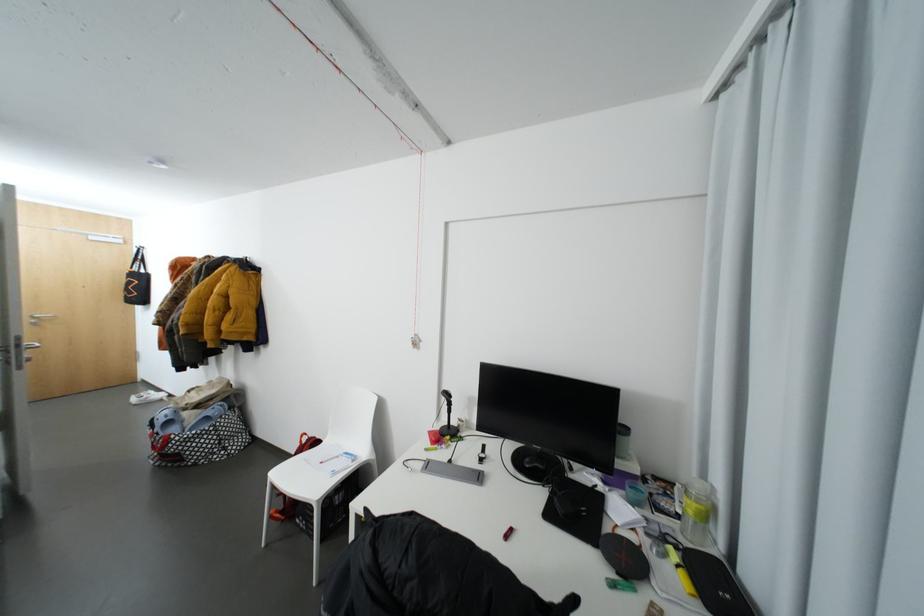
What are the coordinates of `black desk lamp` in the screenshot? It's located at click(x=447, y=416).